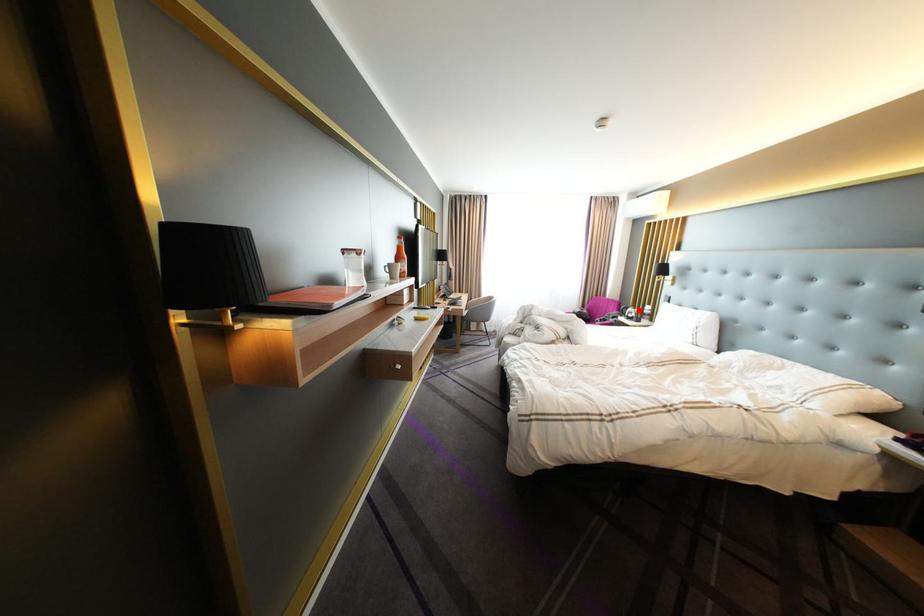
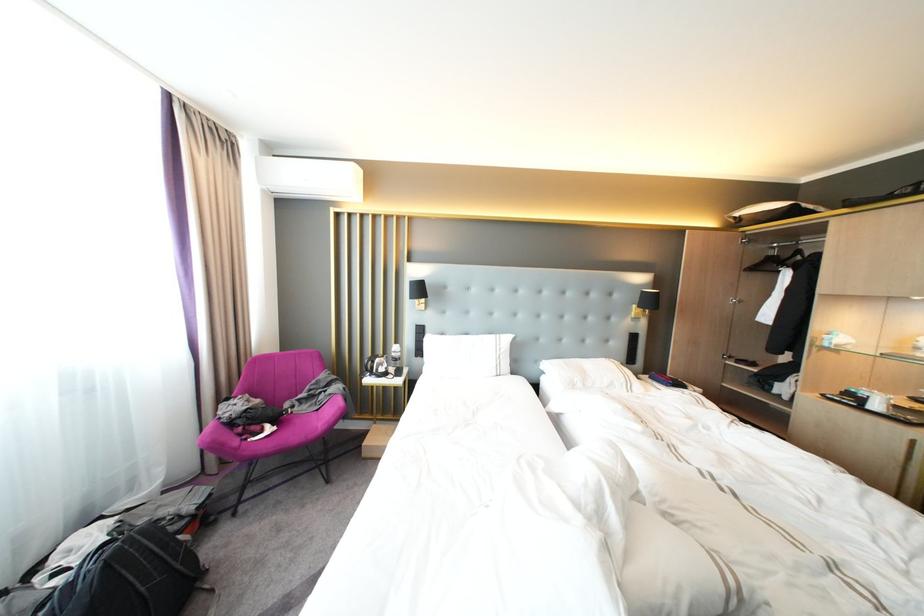
Question: I am providing you with two images of the same scene from different viewpoints. Given a red point in image1, look at the same physical point in image2. Is it:

Choices:
 (A) Closer to the viewpoint
 (B) Farther from the viewpoint

Answer: (B)